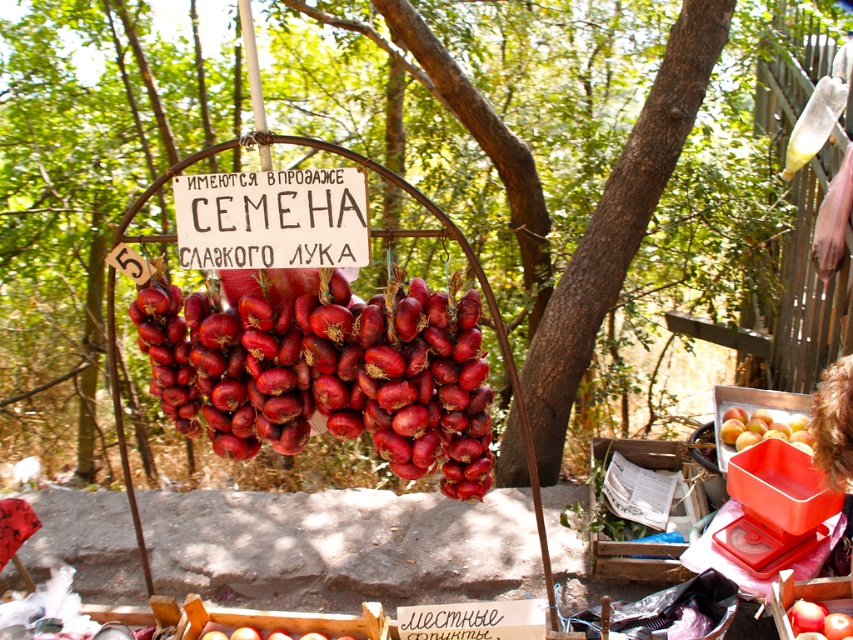
Is point (151, 340) closer to viewer compared to point (746, 426)?

That is True.

Which is in front, point (207, 362) or point (769, 424)?

Positioned in front is point (207, 362).

Is point (149, 317) closer to camera compared to point (746, 436)?

Yes, it is in front of point (746, 436).

Locate an element on the screen. The width and height of the screenshot is (853, 640). shiny red onion at center is located at coordinates (325, 372).